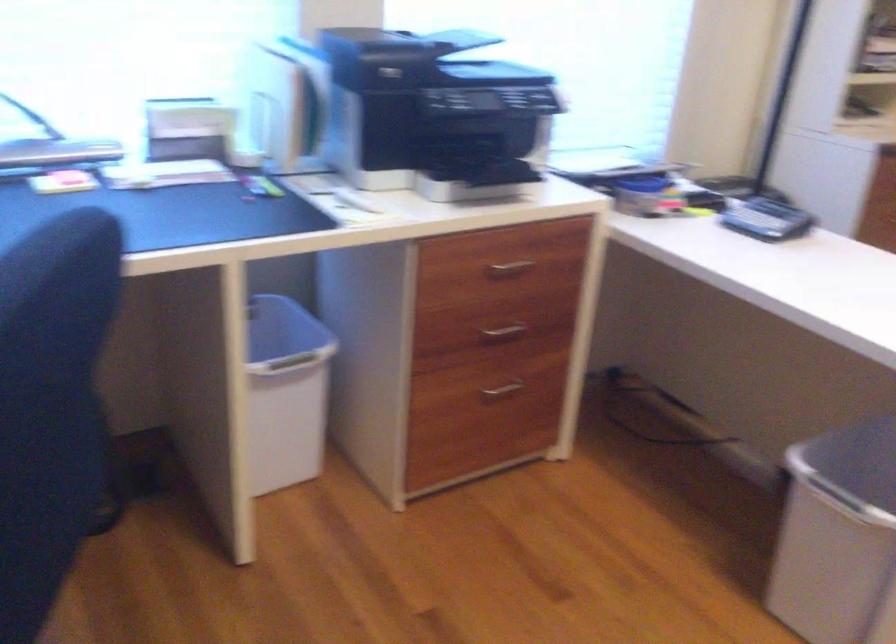
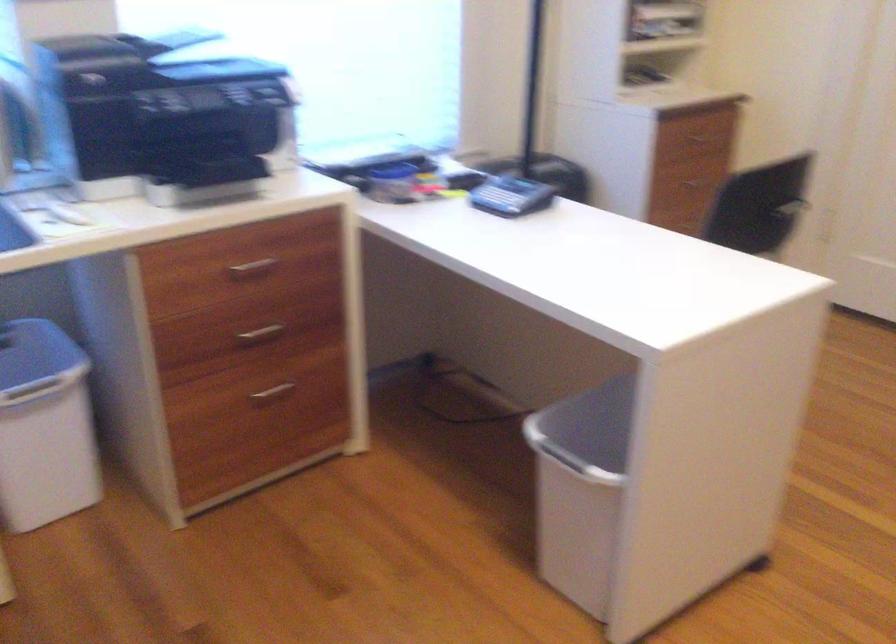
Question: How did the camera likely rotate?

Choices:
 (A) Left
 (B) Right
 (C) Up
 (D) Down

Answer: (B)